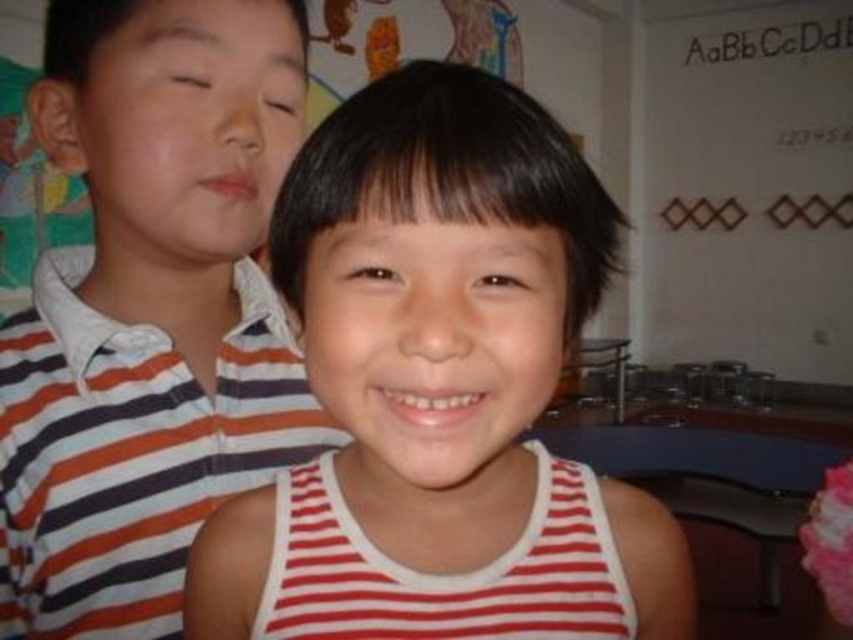
You are a photographer trying to capture a clear shot of both the striped cotton shirt at upper left and the white striped tank top at center. Since you want both subjects in focus, which one should you adjust your camera focus to prioritize first?

The striped cotton shirt at upper left is further to the viewer than the white striped tank top at center, so you should prioritize focusing on the striped cotton shirt at upper left first to ensure both are in focus.

You are a tailor who needs to determine which of the two shirts, the striped cotton shirt at upper left or the white striped tank top at center, requires more fabric for alterations. Based on their sizes, which one would need more material?

The white striped tank top at center requires more fabric for alterations because it is larger than the striped cotton shirt at upper left.